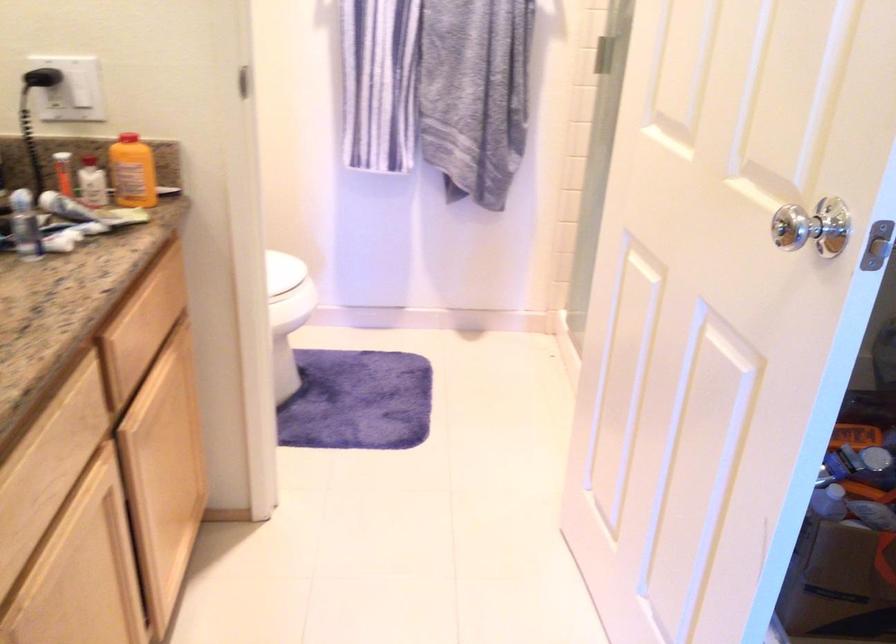
You are a GUI agent. You are given a task and a screenshot of the screen. Output one action in this format:
    pyautogui.click(x=<x>, y=<y>)
    Task: Click on the black electrical plug
    This screenshot has height=644, width=896.
    Given the screenshot: What is the action you would take?
    42,78